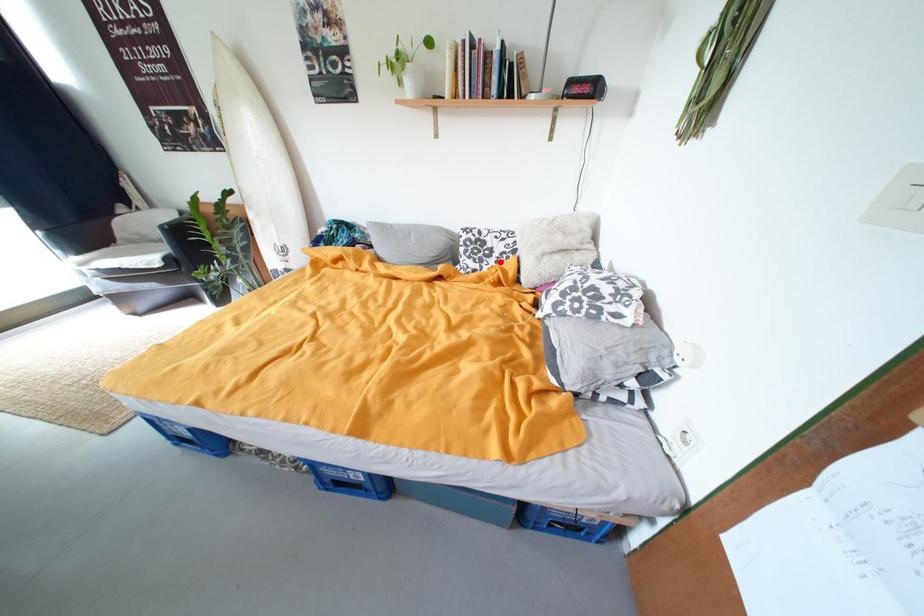
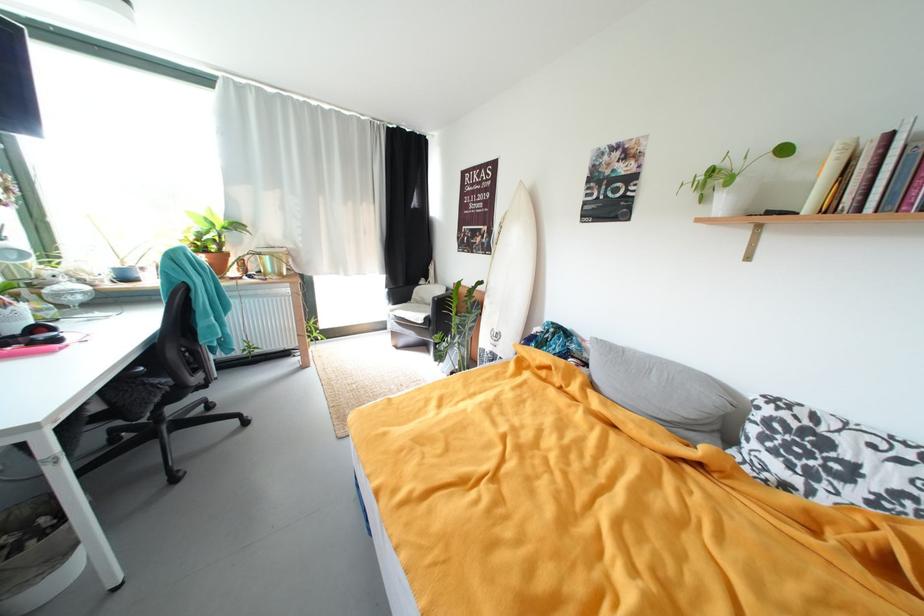
Question: A red point is marked in image1. In image2, is the corresponding 3D point closer to the camera or farther? Reply with the corresponding letter.

Choices:
 (A) The corresponding 3D point is closer.
 (B) The corresponding 3D point is farther.

Answer: (B)